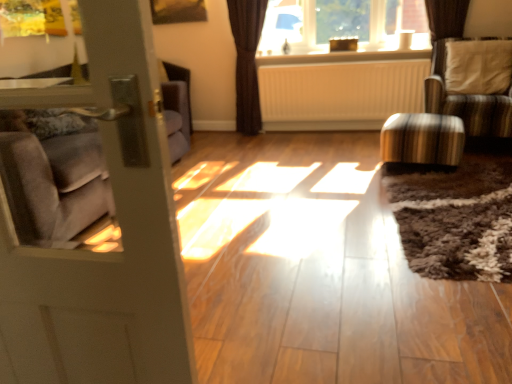
Question: Considering their positions, is clear glass window at upper center located in front of or behind white matte radiator at center?

Choices:
 (A) behind
 (B) front

Answer: (B)

Question: In terms of width, does clear glass window at upper center look wider or thinner when compared to white matte radiator at center?

Choices:
 (A) thin
 (B) wide

Answer: (B)

Question: Estimate the real-world distances between objects in this image. Which object is closer to the clear glass window at upper center?

Choices:
 (A) matte gray door at left
 (B) striped fabric chair at right
 (C) white textured pillow at upper right
 (D) metallic striped stool at right
 (E) brown textured curtain at upper center

Answer: (E)

Question: Estimate the real-world distances between objects in this image. Which object is farther from the brown textured curtain at upper center?

Choices:
 (A) striped fabric chair at right
 (B) white textured pillow at upper right
 (C) clear glass window at upper center
 (D) metallic striped stool at right
 (E) white matte radiator at center

Answer: (B)